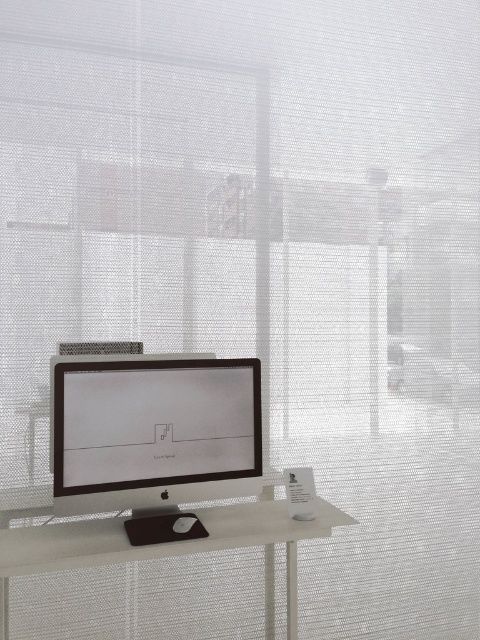
You are standing in front of the desk in the image. There is a point marked at coordinates (155, 422). Which object does this point belong to?

The point at coordinates (155, 422) is on the matte black monitor at center.

You are standing in front of a minimalist workspace setup with a matte black monitor at center. If you want to reach the monitor without moving your feet, can you do it?

The matte black monitor at center is 2.12 meters away from the camera, which is likely your position. Since the average arm length is about 0.7 meters, you cannot reach the matte black monitor at center without moving your feet.

You are standing in the minimalist workspace described. Where is the matte black monitor at center located in relation to the textured white mesh screen in the background?

The matte black monitor at center is located at point (155,422), which is in the foreground closer to the observer compared to the textured white mesh screen in the background.